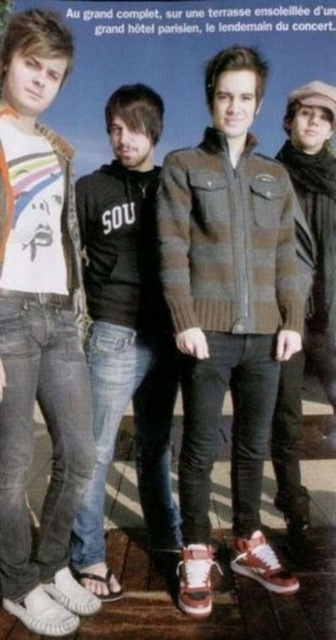
Does white matte t-shirt at left appear on the left side of brown woolen sweater at right?

Correct, you'll find white matte t-shirt at left to the left of brown woolen sweater at right.

Does white matte t-shirt at left have a lesser width compared to brown woolen sweater at right?

No.

Which is behind, point (72, 618) or point (305, 328)?

Positioned behind is point (305, 328).

Image resolution: width=336 pixels, height=640 pixels. I want to click on white matte t-shirt at left, so click(39, 330).

Which is behind, point (72, 440) or point (88, 490)?

The point (88, 490) is behind.

Between white matte t-shirt at left and black cotton hoodie at center, which one appears on the right side from the viewer's perspective?

black cotton hoodie at center is more to the right.

Which is in front, point (60, 454) or point (86, 513)?

Positioned in front is point (60, 454).

This screenshot has height=640, width=336. In order to click on white matte t-shirt at left in this screenshot , I will do `click(39, 330)`.

Between striped wool sweater at center and black cotton hoodie at center, which one is positioned lower?

black cotton hoodie at center is below.

At what (x,y) coordinates should I click in order to perform the action: click on striped wool sweater at center. Please return your answer as a coordinate pair (x, y). This screenshot has width=336, height=640. Looking at the image, I should click on (228, 316).